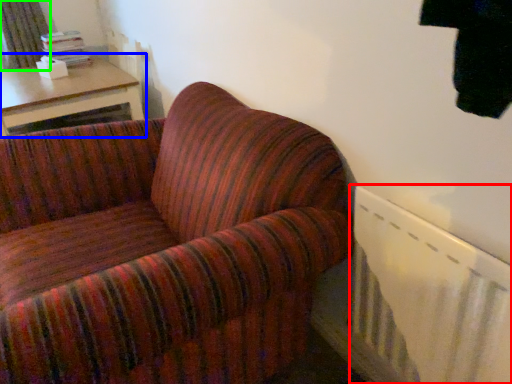
Question: Which object is positioned closest to radiator (highlighted by a red box)? Select from table (highlighted by a blue box) and curtain (highlighted by a green box).

Choices:
 (A) table
 (B) curtain

Answer: (A)